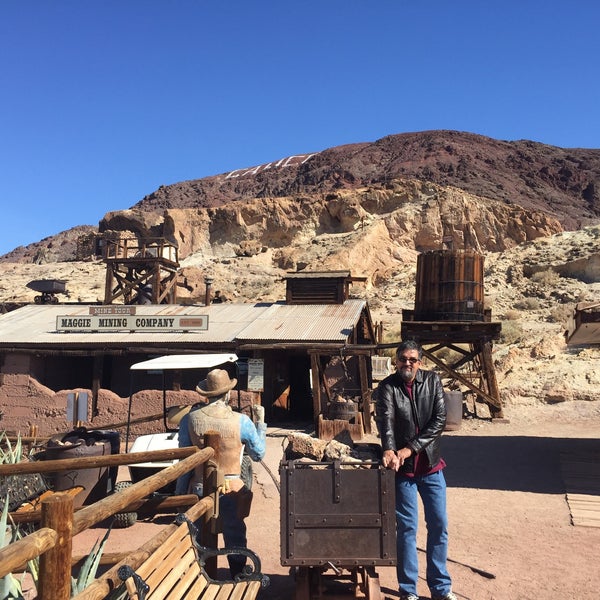
Find the location of `wooden seat`. wooden seat is located at coordinates (171, 574).